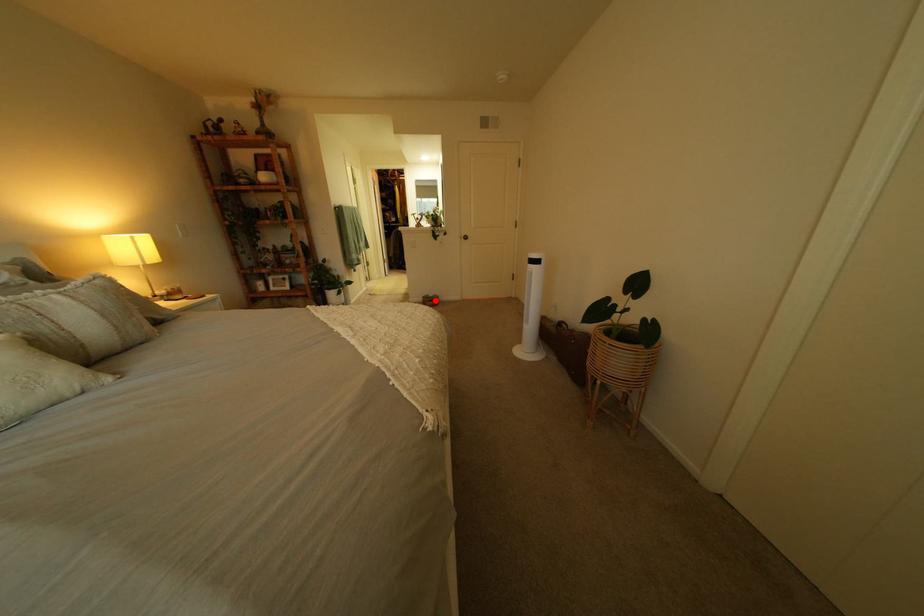
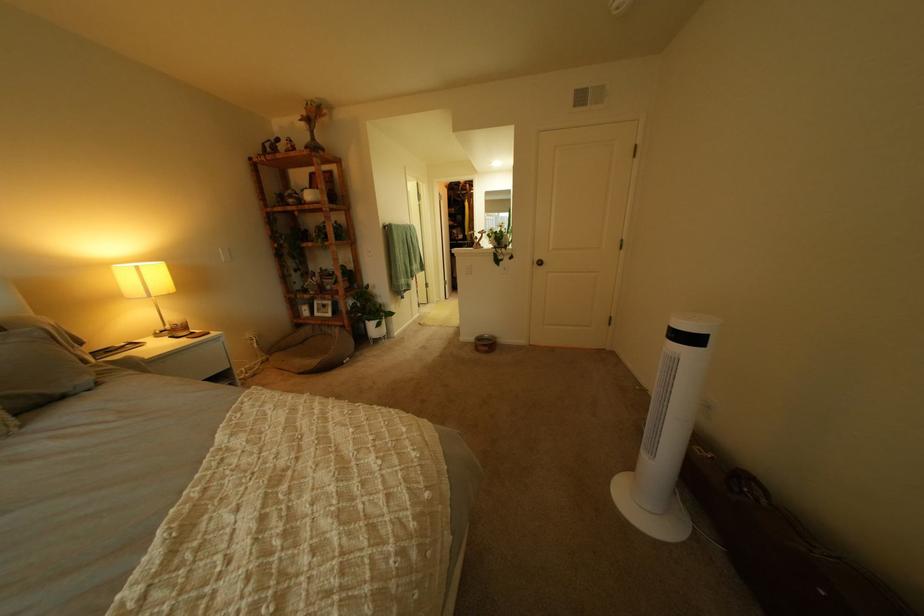
Question: I am providing you with two images of the same scene from different viewpoints. A red point is shown in image1. For the corresponding object point in image2, is it positioned nearer or farther from the camera?

Choices:
 (A) Nearer
 (B) Farther

Answer: (B)